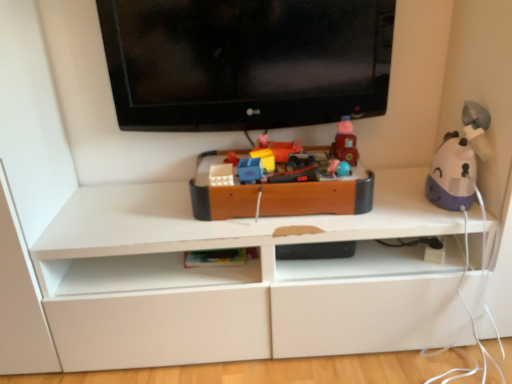
Measure the distance between point (254,177) and camera.

The depth of point (254,177) is 3.83 feet.

The width and height of the screenshot is (512, 384). What do you see at coordinates (317, 196) in the screenshot?
I see `wooden toy train at center, which appears as the 4th toy when viewed from the left` at bounding box center [317, 196].

Locate an element on the screen. The image size is (512, 384). wooden toy train at center, which appears as the 3th toy when viewed from the right is located at coordinates (317, 196).

Describe the element at coordinates (264, 154) in the screenshot. This screenshot has width=512, height=384. I see `matte plastic toy car at center, arranged as the 4th toy when viewed from the right` at that location.

At what (x,y) coordinates should I click in order to perform the action: click on purple matte humidifier at right, the 6th toy from the left. Please return your answer as a coordinate pair (x, y). This screenshot has width=512, height=384. Looking at the image, I should click on (459, 161).

The width and height of the screenshot is (512, 384). Describe the element at coordinates (246, 62) in the screenshot. I see `black glossy tv at upper center` at that location.

Locate an element on the screen. blue plastic toy at center, acting as the 2th toy starting from the left is located at coordinates (250, 170).

Considering the relative sizes of matte plastic toy at center, which is counted as the 1th toy, starting from the left, and black glossy tv at upper center in the image provided, is matte plastic toy at center, which is counted as the 1th toy, starting from the left, bigger than black glossy tv at upper center?

No.

Is point (231, 155) positioned in front of point (298, 103)?

No, (231, 155) is further to viewer.

In the image, there is a matte plastic toy at center, which is counted as the 1th toy, starting from the left. Where is `television above it (from the image's perspective)`? The image size is (512, 384). television above it (from the image's perspective) is located at coordinates (246, 62).

Considering the relative positions of matte plastic toy at center, which is the 6th toy in right-to-left order, and black glossy tv at upper center in the image provided, is matte plastic toy at center, which is the 6th toy in right-to-left order, to the right of black glossy tv at upper center from the viewer's perspective?

In fact, matte plastic toy at center, which is the 6th toy in right-to-left order, is to the left of black glossy tv at upper center.

Which is more to the left, matte plastic toy car at center, the 3th toy positioned from the left, or blue plastic toy at center, positioned as the fifth toy in right-to-left order?

blue plastic toy at center, positioned as the fifth toy in right-to-left order.

Which of these two, matte plastic toy car at center, arranged as the 4th toy when viewed from the right, or blue plastic toy at center, acting as the 2th toy starting from the left, is wider?

matte plastic toy car at center, arranged as the 4th toy when viewed from the right, is wider.

Find the location of a particular element. Image resolution: width=512 pixels, height=384 pixels. the 2nd toy positioned above the blue plastic toy at center, positioned as the fifth toy in right-to-left order (from a real-world perspective) is located at coordinates (264, 154).

Can you tell me how much matte plastic toy car at center, the 3th toy positioned from the left, and blue plastic toy at center, acting as the 2th toy starting from the left, differ in facing direction?

The facing directions of matte plastic toy car at center, the 3th toy positioned from the left, and blue plastic toy at center, acting as the 2th toy starting from the left, are 0.0018 degrees apart.

From a real-world perspective, is matte plastic toy car at center, arranged as the 4th toy when viewed from the right, physically located above or below matte plastic toy at center, which is the 6th toy in right-to-left order?

matte plastic toy car at center, arranged as the 4th toy when viewed from the right, is situated higher than matte plastic toy at center, which is the 6th toy in right-to-left order, in the real world.

Considering the sizes of objects matte plastic toy car at center, the 3th toy positioned from the left, and matte plastic toy at center, which is counted as the 1th toy, starting from the left, in the image provided, who is smaller, matte plastic toy car at center, the 3th toy positioned from the left, or matte plastic toy at center, which is counted as the 1th toy, starting from the left,?

With smaller size is matte plastic toy at center, which is counted as the 1th toy, starting from the left.

Which of these two, matte plastic toy car at center, the 3th toy positioned from the left, or matte plastic toy at center, which is the 6th toy in right-to-left order, stands shorter?

Standing shorter between the two is matte plastic toy at center, which is the 6th toy in right-to-left order.

Which object is positioned more to the left, matte plastic toy car at center, the 3th toy positioned from the left, or matte plastic toy at center, which is counted as the 1th toy, starting from the left?

matte plastic toy at center, which is counted as the 1th toy, starting from the left, is more to the left.

Is point (259, 149) in front of point (305, 87)?

No, it is not.

Does matte plastic toy car at center, the 3th toy positioned from the left, have a smaller size compared to black glossy tv at upper center?

Yes.

Is matte plastic toy car at center, arranged as the 4th toy when viewed from the right, facing away from black glossy tv at upper center?

No, matte plastic toy car at center, arranged as the 4th toy when viewed from the right, is not facing away from black glossy tv at upper center.

You are a GUI agent. You are given a task and a screenshot of the screen. Output one action in this format:
    pyautogui.click(x=<x>, y=<y>)
    Task: Click on the toy that is the 3rd object located below the black glossy tv at upper center (from the image's perspective)
    The image size is (512, 384).
    Given the screenshot: What is the action you would take?
    pyautogui.click(x=264, y=154)

Which object is further away from the camera, matte plastic toy at center, which is counted as the 1th toy, starting from the left, or matte plastic toy car at center, arranged as the 4th toy when viewed from the right?

matte plastic toy at center, which is counted as the 1th toy, starting from the left, is behind.

Which is more to the right, matte plastic toy at center, which is the 6th toy in right-to-left order, or matte plastic toy car at center, the 3th toy positioned from the left?

matte plastic toy car at center, the 3th toy positioned from the left, is more to the right.

Considering the relative sizes of matte plastic toy at center, which is the 6th toy in right-to-left order, and matte plastic toy car at center, arranged as the 4th toy when viewed from the right, in the image provided, is matte plastic toy at center, which is the 6th toy in right-to-left order, wider than matte plastic toy car at center, arranged as the 4th toy when viewed from the right,?

No, matte plastic toy at center, which is the 6th toy in right-to-left order, is not wider than matte plastic toy car at center, arranged as the 4th toy when viewed from the right.

Is matte plastic toy at center, which is the 6th toy in right-to-left order, facing away from matte plastic toy car at center, the 3th toy positioned from the left?

matte plastic toy at center, which is the 6th toy in right-to-left order, does not have its back to matte plastic toy car at center, the 3th toy positioned from the left.

Would you say matte plastic toy at center, acting as the 5th toy starting from the left, is part of wooden toy train at center, which appears as the 3th toy when viewed from the right,'s contents?

No, matte plastic toy at center, acting as the 5th toy starting from the left, is not surrounded by wooden toy train at center, which appears as the 3th toy when viewed from the right.

How many degrees apart are the facing directions of wooden toy train at center, which appears as the 3th toy when viewed from the right, and matte plastic toy at center, the second toy positioned from the right?

90 degrees separate the facing orientations of wooden toy train at center, which appears as the 3th toy when viewed from the right, and matte plastic toy at center, the second toy positioned from the right.

From a real-world perspective, is wooden toy train at center, which appears as the 3th toy when viewed from the right, positioned over matte plastic toy at center, acting as the 5th toy starting from the left, based on gravity?

Incorrect, from a real-world perspective, wooden toy train at center, which appears as the 3th toy when viewed from the right, is lower than matte plastic toy at center, acting as the 5th toy starting from the left.

From a real-world perspective, which object rests below the other?

matte plastic toy at center, which is the 6th toy in right-to-left order, from a real-world perspective.

Locate an element on the screen. the 4th toy to the right of the matte plastic toy at center, which is the 6th toy in right-to-left order, starting your count from the anchor is located at coordinates (345, 142).

Is matte plastic toy at center, the second toy positioned from the right, not inside matte plastic toy at center, which is the 6th toy in right-to-left order?

matte plastic toy at center, the second toy positioned from the right, is positioned outside matte plastic toy at center, which is the 6th toy in right-to-left order.

Is matte plastic toy at center, acting as the 5th toy starting from the left, turned away from matte plastic toy at center, which is the 6th toy in right-to-left order?

No, matte plastic toy at center, acting as the 5th toy starting from the left, is not facing away from matte plastic toy at center, which is the 6th toy in right-to-left order.

At what (x,y) coordinates should I click in order to perform the action: click on the 5th toy behind when counting from the black glossy tv at upper center. Please return your answer as a coordinate pair (x, y). The image size is (512, 384). Looking at the image, I should click on (232, 158).

Which toy is the 1st one when counting from the left side of the matte plastic toy car at center, the 3th toy positioned from the left? Please provide its 2D coordinates.

[(250, 170)]

Which object lies nearer to the anchor point blue plastic toy at center, positioned as the fifth toy in right-to-left order, matte plastic toy at center, the second toy positioned from the right, or black glossy tv at upper center?

matte plastic toy at center, the second toy positioned from the right, is positioned closer to the anchor blue plastic toy at center, positioned as the fifth toy in right-to-left order.

Considering their positions, is purple matte humidifier at right, acting as the 1th toy starting from the right, positioned closer to black glossy tv at upper center than blue plastic toy at center, acting as the 2th toy starting from the left?

blue plastic toy at center, acting as the 2th toy starting from the left, lies closer to black glossy tv at upper center than the other object.

Which object lies nearer to the anchor point purple matte humidifier at right, acting as the 1th toy starting from the right, matte plastic toy at center, acting as the 5th toy starting from the left, or blue plastic toy at center, acting as the 2th toy starting from the left?

matte plastic toy at center, acting as the 5th toy starting from the left.

Considering their positions, is matte plastic toy car at center, arranged as the 4th toy when viewed from the right, positioned further to matte plastic toy at center, acting as the 5th toy starting from the left, than purple matte humidifier at right, acting as the 1th toy starting from the right?

The object further to matte plastic toy at center, acting as the 5th toy starting from the left, is purple matte humidifier at right, acting as the 1th toy starting from the right.

From the image, which object appears to be nearer to matte plastic toy at center, which is the 6th toy in right-to-left order, purple matte humidifier at right, the 6th toy from the left, or matte plastic toy at center, acting as the 5th toy starting from the left?

The object closer to matte plastic toy at center, which is the 6th toy in right-to-left order, is matte plastic toy at center, acting as the 5th toy starting from the left.

When comparing their distances from matte plastic toy car at center, arranged as the 4th toy when viewed from the right, does black glossy tv at upper center or wooden toy train at center, which appears as the 3th toy when viewed from the right, seem further?

black glossy tv at upper center lies further to matte plastic toy car at center, arranged as the 4th toy when viewed from the right, than the other object.

Looking at the image, which one is located closer to purple matte humidifier at right, acting as the 1th toy starting from the right, blue plastic toy at center, acting as the 2th toy starting from the left, or wooden toy train at center, which appears as the 3th toy when viewed from the right?

Among the two, wooden toy train at center, which appears as the 3th toy when viewed from the right, is located nearer to purple matte humidifier at right, acting as the 1th toy starting from the right.

Which object lies further to the anchor point black glossy tv at upper center, matte plastic toy car at center, arranged as the 4th toy when viewed from the right, or wooden toy train at center, which appears as the 4th toy when viewed from the left?

matte plastic toy car at center, arranged as the 4th toy when viewed from the right, is positioned further to the anchor black glossy tv at upper center.

At what (x,y) coordinates should I click in order to perform the action: click on television located between blue plastic toy at center, positioned as the fifth toy in right-to-left order, and purple matte humidifier at right, acting as the 1th toy starting from the right, in the left-right direction. Please return your answer as a coordinate pair (x, y). The height and width of the screenshot is (384, 512). Looking at the image, I should click on (246, 62).

Locate an element on the screen. The width and height of the screenshot is (512, 384). television between matte plastic toy at center, which is the 6th toy in right-to-left order, and matte plastic toy at center, acting as the 5th toy starting from the left is located at coordinates pyautogui.click(x=246, y=62).

Locate an element on the screen. toy between matte plastic toy car at center, arranged as the 4th toy when viewed from the right, and matte plastic toy at center, acting as the 5th toy starting from the left, from left to right is located at coordinates (317, 196).

Where is `toy located between wooden toy train at center, which appears as the 4th toy when viewed from the left, and purple matte humidifier at right, the 6th toy from the left, in the left-right direction`? This screenshot has width=512, height=384. toy located between wooden toy train at center, which appears as the 4th toy when viewed from the left, and purple matte humidifier at right, the 6th toy from the left, in the left-right direction is located at coordinates [x=345, y=142].